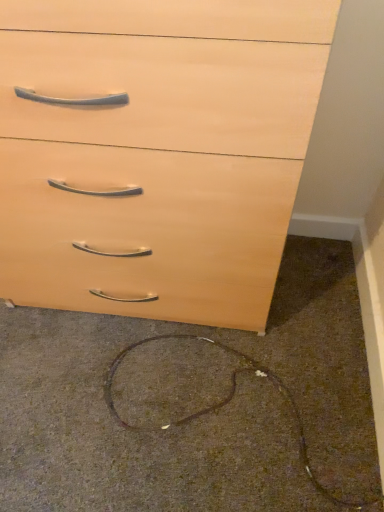
What is the approximate height of brown matte wire at lower center?

The height of brown matte wire at lower center is 1.70 inches.

Image resolution: width=384 pixels, height=512 pixels. What are the coordinates of `brown matte wire at lower center` in the screenshot? It's located at (198, 419).

The image size is (384, 512). What do you see at coordinates (198, 419) in the screenshot? I see `brown matte wire at lower center` at bounding box center [198, 419].

Describe the element at coordinates (156, 151) in the screenshot. Image resolution: width=384 pixels, height=512 pixels. I see `light wood/finish chest of drawers at upper center` at that location.

In order to click on light wood/finish chest of drawers at upper center in this screenshot , I will do `click(156, 151)`.

Where is `brown matte wire at lower center`? The image size is (384, 512). brown matte wire at lower center is located at coordinates (198, 419).

Considering the relative positions of brown matte wire at lower center and light wood/finish chest of drawers at upper center in the image provided, is brown matte wire at lower center to the left of light wood/finish chest of drawers at upper center from the viewer's perspective?

No.

Is the position of brown matte wire at lower center more distant than that of light wood/finish chest of drawers at upper center?

Yes, it is behind light wood/finish chest of drawers at upper center.

Which point is more forward, (219, 482) or (111, 83)?

The point (111, 83) is closer.

From the image's perspective, which object appears higher, brown matte wire at lower center or light wood/finish chest of drawers at upper center?

light wood/finish chest of drawers at upper center is shown above in the image.

From a real-world perspective, which object stands above the other?

light wood/finish chest of drawers at upper center is physically above.

Is brown matte wire at lower center thinner than light wood/finish chest of drawers at upper center?

In fact, brown matte wire at lower center might be wider than light wood/finish chest of drawers at upper center.

Which of these two, brown matte wire at lower center or light wood/finish chest of drawers at upper center, stands shorter?

With less height is brown matte wire at lower center.

In terms of size, does brown matte wire at lower center appear bigger or smaller than light wood/finish chest of drawers at upper center?

brown matte wire at lower center is smaller than light wood/finish chest of drawers at upper center.

Is brown matte wire at lower center positioned beyond the bounds of light wood/finish chest of drawers at upper center?

Absolutely, brown matte wire at lower center is external to light wood/finish chest of drawers at upper center.

Is the surface of brown matte wire at lower center in direct contact with light wood/finish chest of drawers at upper center?

There is a gap between brown matte wire at lower center and light wood/finish chest of drawers at upper center.

Is brown matte wire at lower center oriented away from light wood/finish chest of drawers at upper center?

brown matte wire at lower center does not have its back to light wood/finish chest of drawers at upper center.

How different are the orientations of brown matte wire at lower center and light wood/finish chest of drawers at upper center in degrees?

The facing directions of brown matte wire at lower center and light wood/finish chest of drawers at upper center are 0.658 degrees apart.

You are a GUI agent. You are given a task and a screenshot of the screen. Output one action in this format:
    pyautogui.click(x=<x>, y=<y>)
    Task: Click on the concrete that appears below the light wood/finish chest of drawers at upper center (from the image's perspective)
    The height and width of the screenshot is (512, 384).
    Given the screenshot: What is the action you would take?
    pyautogui.click(x=198, y=419)

Considering the positions of objects light wood/finish chest of drawers at upper center and brown matte wire at lower center in the image provided, who is more to the right, light wood/finish chest of drawers at upper center or brown matte wire at lower center?

Positioned to the right is brown matte wire at lower center.

Between light wood/finish chest of drawers at upper center and brown matte wire at lower center, which one is positioned behind?

Positioned behind is brown matte wire at lower center.

Considering the points (182, 217) and (242, 445), which point is behind, point (182, 217) or point (242, 445)?

Positioned behind is point (242, 445).

From the image's perspective, which one is positioned lower, light wood/finish chest of drawers at upper center or brown matte wire at lower center?

brown matte wire at lower center appears lower in the image.

From a real-world perspective, which object rests below the other?

In real-world perspective, brown matte wire at lower center is lower.

Does light wood/finish chest of drawers at upper center have a lesser width compared to brown matte wire at lower center?

Yes.

Who is taller, light wood/finish chest of drawers at upper center or brown matte wire at lower center?

With more height is light wood/finish chest of drawers at upper center.

Consider the image. Who is bigger, light wood/finish chest of drawers at upper center or brown matte wire at lower center?

With larger size is light wood/finish chest of drawers at upper center.

Would you say brown matte wire at lower center is part of light wood/finish chest of drawers at upper center's contents?

No, light wood/finish chest of drawers at upper center does not contain brown matte wire at lower center.

Are light wood/finish chest of drawers at upper center and brown matte wire at lower center far apart?

No, light wood/finish chest of drawers at upper center is not far from brown matte wire at lower center.

Is light wood/finish chest of drawers at upper center positioned with its back to brown matte wire at lower center?

No, light wood/finish chest of drawers at upper center's orientation is not away from brown matte wire at lower center.

Locate an element on the screen. the chest of drawers in front of the brown matte wire at lower center is located at coordinates (156, 151).

The image size is (384, 512). What are the coordinates of `chest of drawers above the brown matte wire at lower center (from the image's perspective)` in the screenshot? It's located at (156, 151).

Where is `chest of drawers that appears on the left of brown matte wire at lower center`? This screenshot has height=512, width=384. chest of drawers that appears on the left of brown matte wire at lower center is located at coordinates click(156, 151).